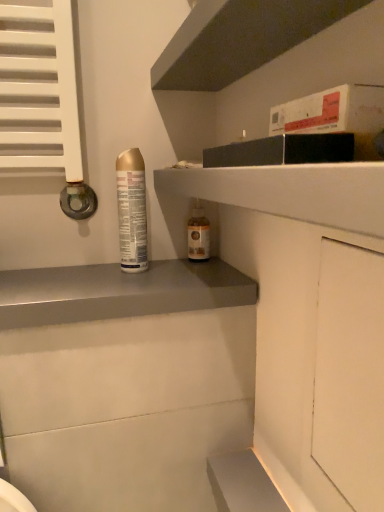
Where is `empty space that is ontop of smooth gray shelf at center, placed as the first shelf when sorted from bottom to top (from a real-world perspective)`? This screenshot has height=512, width=384. empty space that is ontop of smooth gray shelf at center, placed as the first shelf when sorted from bottom to top (from a real-world perspective) is located at coordinates (115, 278).